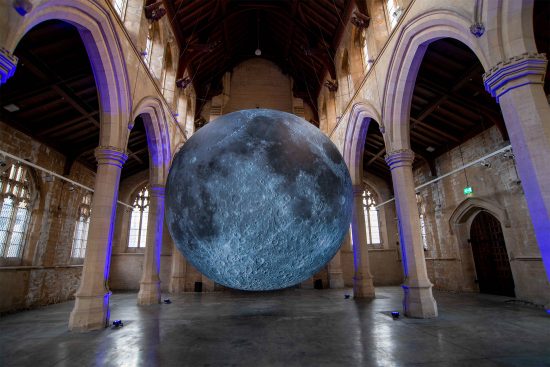
This screenshot has width=550, height=367. Identify the location of floor. (240, 356).